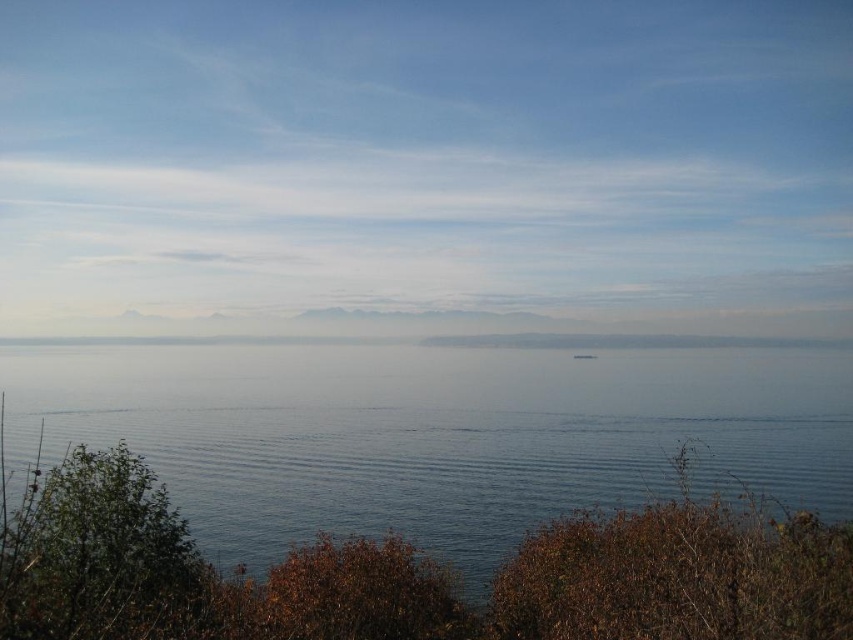
Question: Which point is farther to the camera?

Choices:
 (A) transparent water at center
 (B) white plastic boat at center

Answer: (B)

Question: Which point is closer to the camera?

Choices:
 (A) (225, 436)
 (B) (587, 356)

Answer: (A)

Question: Is transparent water at center to the left of white plastic boat at center from the viewer's perspective?

Choices:
 (A) yes
 (B) no

Answer: (A)

Question: Which point is closer to the camera?

Choices:
 (A) 592,358
 (B) 244,509

Answer: (B)

Question: Is transparent water at center to the left of white plastic boat at center from the viewer's perspective?

Choices:
 (A) no
 (B) yes

Answer: (B)

Question: Does transparent water at center have a larger size compared to white plastic boat at center?

Choices:
 (A) no
 (B) yes

Answer: (B)